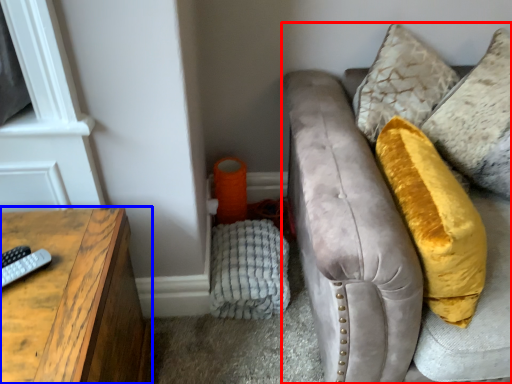
Question: Which point is closer to the camera, studio couch (highlighted by a red box) or table (highlighted by a blue box)?

Choices:
 (A) studio couch
 (B) table

Answer: (B)